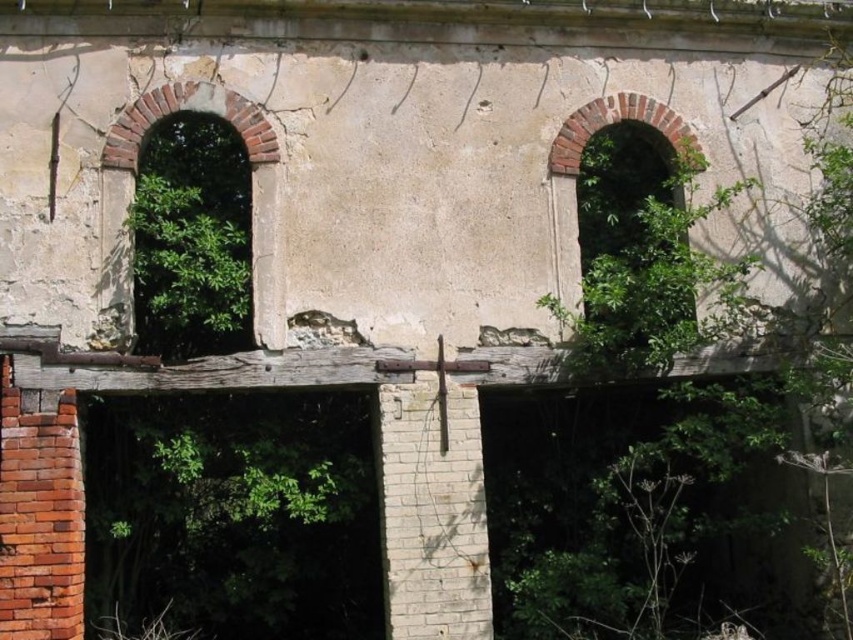
Question: Is green leafy tree at left positioned at the back of brick textured window at left?

Choices:
 (A) no
 (B) yes

Answer: (A)

Question: Does green leafy tree at left appear on the right side of brick textured window at left?

Choices:
 (A) yes
 (B) no

Answer: (B)

Question: Does green leafy tree at left have a greater width compared to brick textured window at left?

Choices:
 (A) no
 (B) yes

Answer: (A)

Question: Which of the following is the farthest from the observer?

Choices:
 (A) brick textured window at left
 (B) green leafy tree at left

Answer: (A)